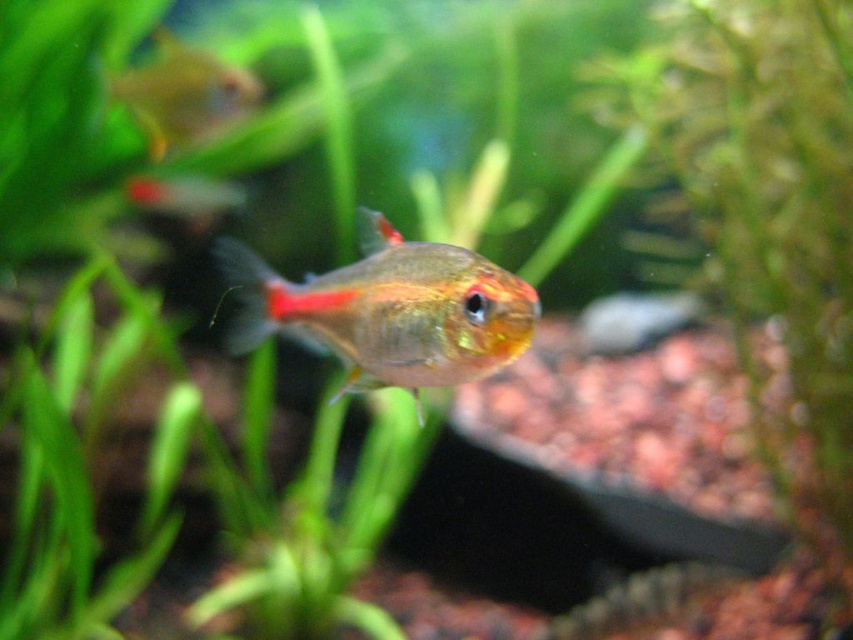
You are a diver in the aquarium and want to reach both the point at coordinates point (328, 289) and point (180, 104). Which point should you swim towards first to reach the closer one first?

You should swim towards point (328, 289) first because it is closer to you than point (180, 104).

You are an aquarium maintenance worker. You need to determine if the translucent glass fish at center and the translucent glass fish at upper left can be placed in a small tank that can only accommodate one of them. Which one should you choose based on their sizes?

The translucent glass fish at center occupies less space than the translucent glass fish at upper left, so you should choose the translucent glass fish at center for the small tank.